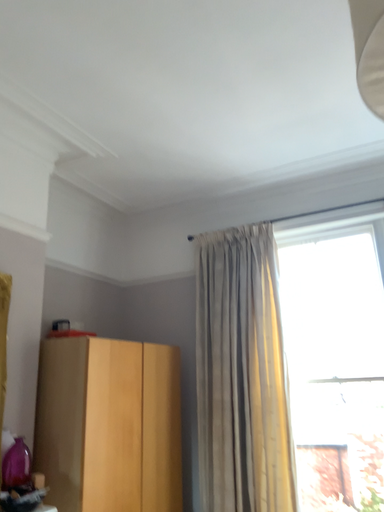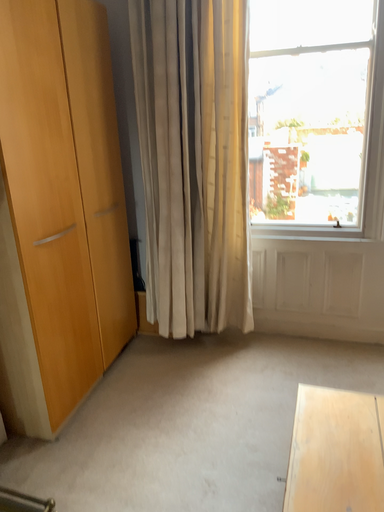
Question: How did the camera likely rotate when shooting the video?

Choices:
 (A) rotated right
 (B) rotated left

Answer: (A)